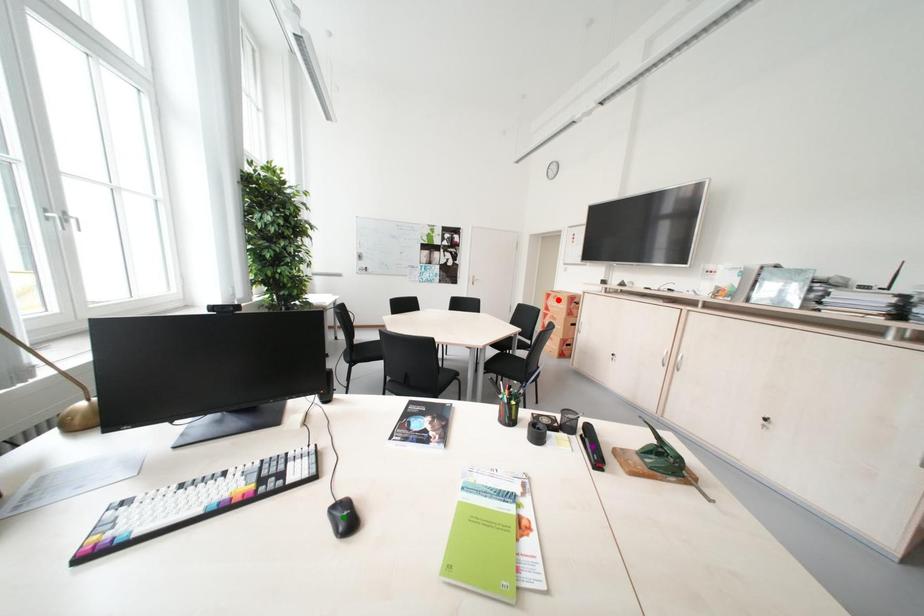
Order these from nearest to farthest:
A) purple point
B) green point
C) red point

green point
purple point
red point